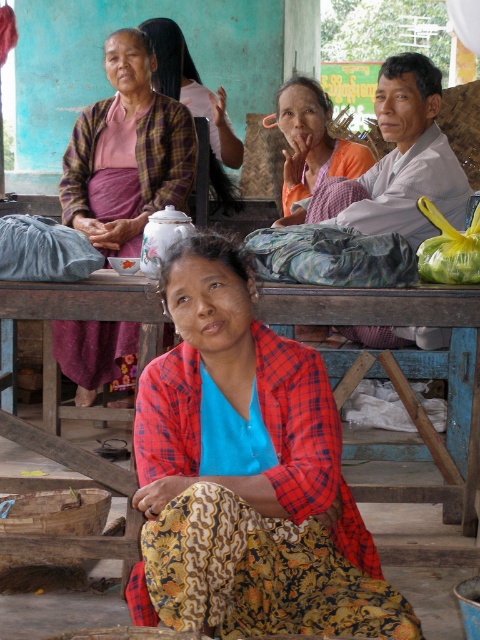
Which is behind, point (60, 193) or point (420, 269)?

Positioned behind is point (60, 193).

How far apart are plaid fabric shirt at upper left and yellow plastic bag at center?

plaid fabric shirt at upper left is 6.37 feet from yellow plastic bag at center.

This screenshot has width=480, height=640. What do you see at coordinates (127, 152) in the screenshot?
I see `plaid fabric shirt at upper left` at bounding box center [127, 152].

Identify the location of plaid fabric shirt at upper left. (127, 152).

Consider the image. Is plaid fabric shirt at upper left behind orange fabric at center?

Yes, plaid fabric shirt at upper left is behind orange fabric at center.

Does point (117, 362) come closer to viewer compared to point (321, 177)?

Yes, point (117, 362) is in front of point (321, 177).

What are the coordinates of `plaid fabric shirt at upper left` in the screenshot? It's located at (127, 152).

Can you confirm if wooden table at center is wider than plaid fabric shirt at upper left?

No.

Is point (466, 301) farther from viewer compared to point (81, 124)?

No, it is not.

Where is `wooden table at center`? The height and width of the screenshot is (640, 480). wooden table at center is located at coordinates tap(408, 360).